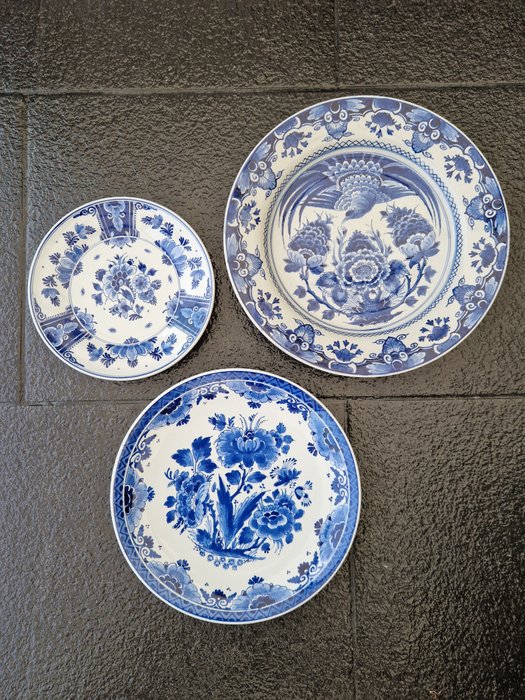
This screenshot has height=700, width=525. In order to click on 3 plates in this screenshot , I will do `click(365, 278)`.